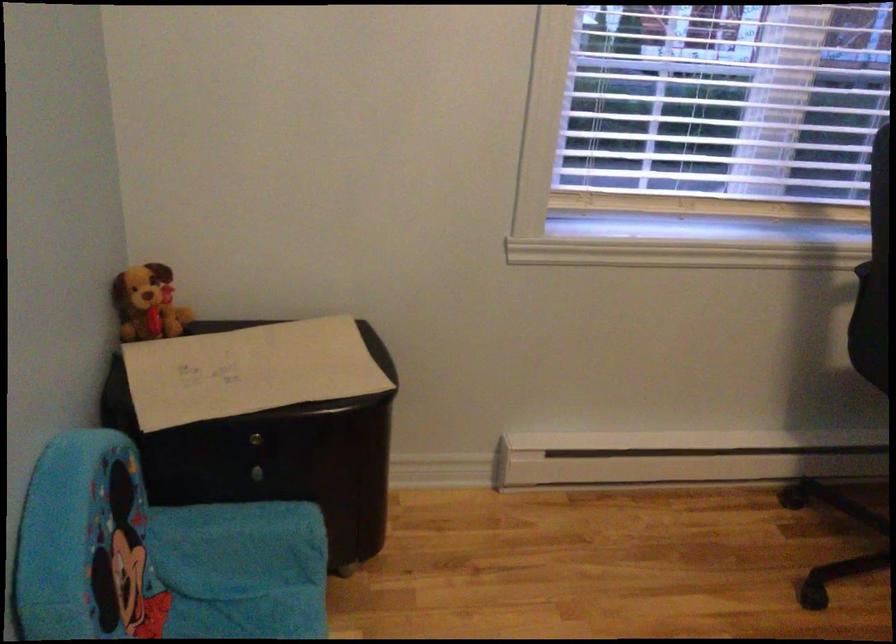
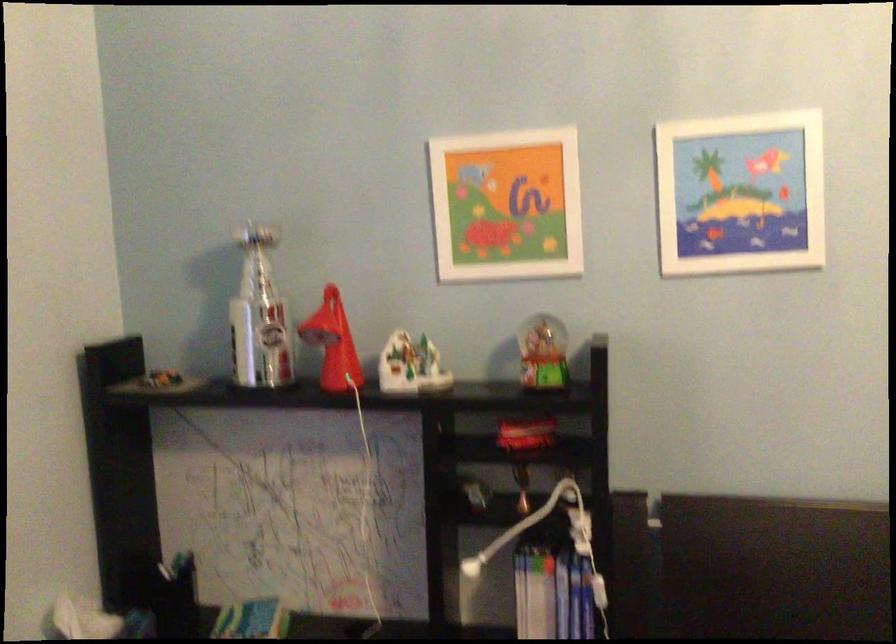
Question: Based on the continuous images, in which direction is the camera rotating? Reply with the corresponding letter.

Choices:
 (A) Left
 (B) Right
 (C) Up
 (D) Down

Answer: (B)